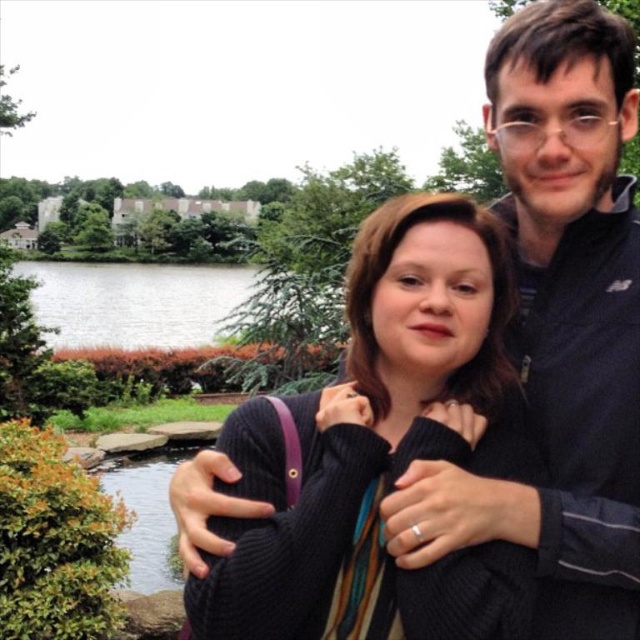
From the picture: Which is below, black sweater at center or green grass at lower left?

Positioned lower is black sweater at center.

Which is more to the left, black sweater at center or green grass at lower left?

green grass at lower left is more to the left.

From the picture: Measure the distance between black sweater at center and camera.

black sweater at center is 6.46 meters away from camera.

This screenshot has width=640, height=640. In order to click on black sweater at center in this screenshot , I will do `click(381, 449)`.